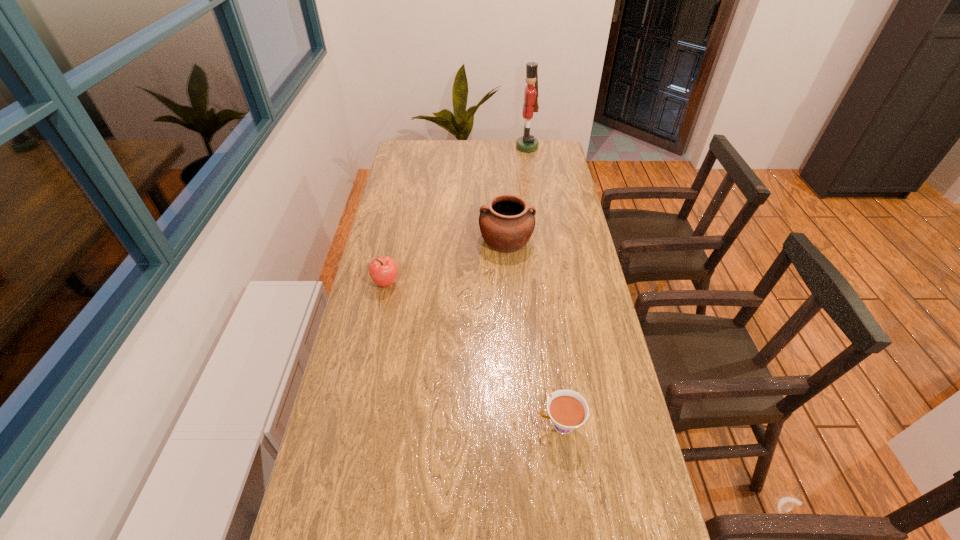
Select which object is the second closest to the nutcracker. Please provide its 2D coordinates. Your answer should be formatted as a tuple, i.e. [(x, y)], where the tuple contains the x and y coordinates of a point satisfying the conditions above.

[(383, 270)]

Where is `object that is the second closest to the pottery`? object that is the second closest to the pottery is located at coordinates (527, 143).